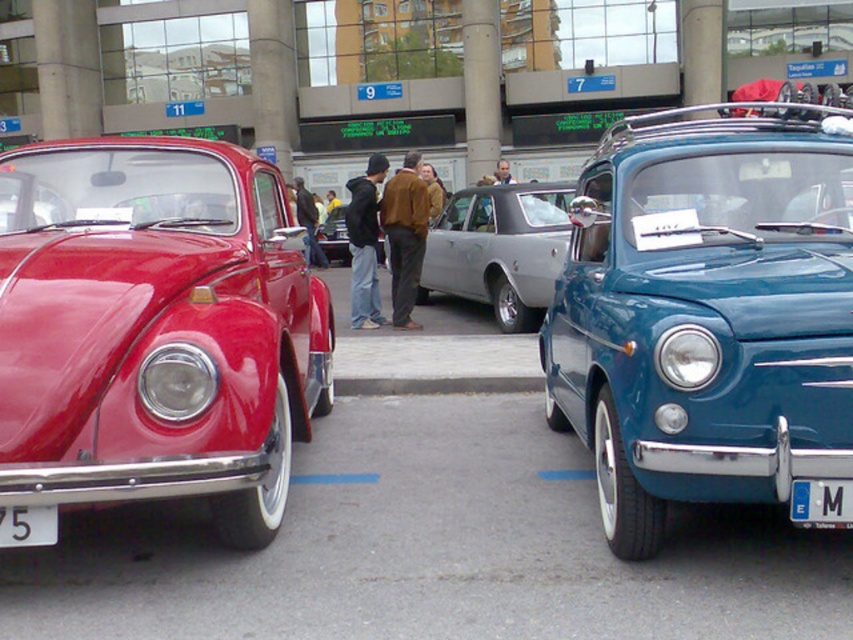
You are a photographer setting up a tripod between the silver metallic sedan at center and the shiny black car at center. Which car should you place the tripod closer to if you want it to be between them?

You should place the tripod closer to the shiny black car at center because the silver metallic sedan at center is positioned on the right side of it, meaning the shiny black car is on the left side. The tripod needs to be between them, so positioning it closer to the shiny black car at center would place it in the middle.

You are a parking attendant who needs to park a new car that requires at least 5 feet of space between it and any license plates. You see the teal glossy car at right and the white plastic license plate at center. Is there enough space between them for the new car?

The distance between the teal glossy car at right and the white plastic license plate at center is 4.88 feet, which is less than the required 5 feet. Therefore, there isn not enough space to park the new car between them.

You are a photographer positioned at the center of the scene. You want to capture a photo that includes both the teal glossy car at right and the matte red car at left. Which car should you adjust your camera angle to look up at, and which one to look down at?

The teal glossy car at right is located above the matte red car at left, so you should adjust your camera angle to look up at the teal glossy car at right and look down at the matte red car at left.